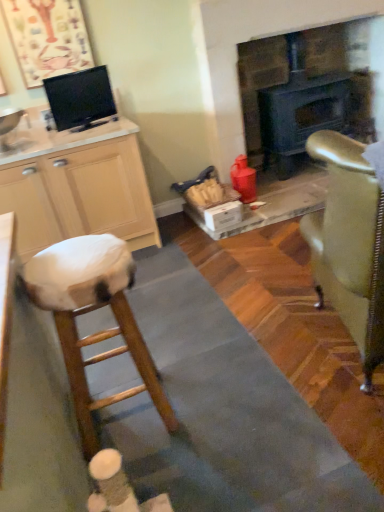
Question: Based on their sizes in the image, would you say black glossy tv at upper left is bigger or smaller than wooden stool at left?

Choices:
 (A) big
 (B) small

Answer: (B)

Question: From a real-world perspective, is black glossy tv at upper left positioned above or below wooden stool at left?

Choices:
 (A) below
 (B) above

Answer: (B)

Question: Based on their relative distances, which object is farther from the beige wood cabinet at left?

Choices:
 (A) wooden stool at left
 (B) matte black fireplace at center
 (C) white glossy sink at left
 (D) black glossy tv at upper left
 (E) gold metallic chair at right

Answer: (B)

Question: Which of these objects is positioned closest to the wooden stool at left?

Choices:
 (A) black glossy tv at upper left
 (B) white glossy sink at left
 (C) matte black fireplace at center
 (D) beige wood cabinet at left
 (E) gold metallic chair at right

Answer: (E)